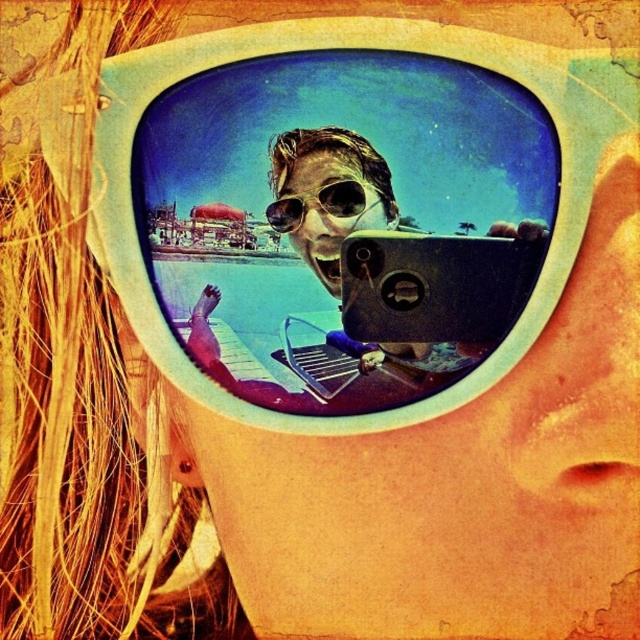
Question: Is matte plastic face at center further to camera compared to matte white sunglasses at center?

Choices:
 (A) no
 (B) yes

Answer: (A)

Question: Which point appears closest to the camera in this image?

Choices:
 (A) (328, 244)
 (B) (323, 188)

Answer: (A)

Question: Which point is closer to the camera taking this photo?

Choices:
 (A) (352, 157)
 (B) (348, 193)

Answer: (B)

Question: Does matte plastic face at center appear under matte white sunglasses at center?

Choices:
 (A) no
 (B) yes

Answer: (B)

Question: Observing the image, what is the correct spatial positioning of matte plastic face at center in reference to matte white sunglasses at center?

Choices:
 (A) left
 (B) right

Answer: (B)